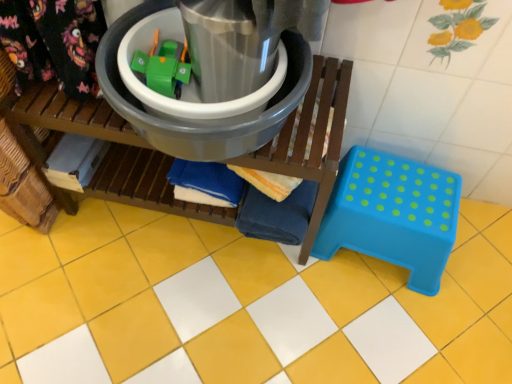
You are a GUI agent. You are given a task and a screenshot of the screen. Output one action in this format:
    pyautogui.click(x=<x>, y=<y>)
    Task: Click on the free location to the right of blue plastic step stool at lower right
    The height and width of the screenshot is (384, 512).
    Given the screenshot: What is the action you would take?
    pyautogui.click(x=479, y=262)